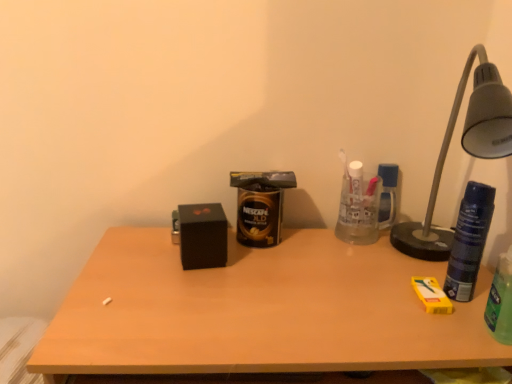
Find the location of a particular element. The height and width of the screenshot is (384, 512). vacant space that is in between green plastic bottle at right, which is the 3th beverage from left to right, and gold metallic can at center, arranged as the third beverage when viewed from the front is located at coordinates (355, 278).